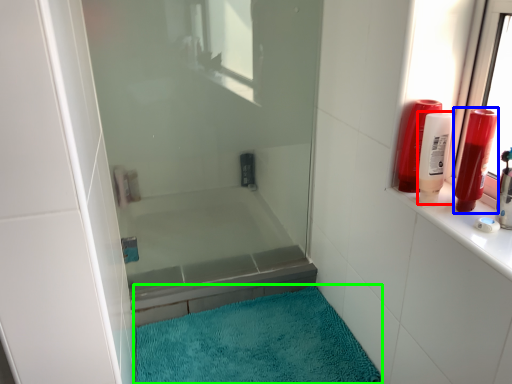
Question: Which is nearer to the toiletry (highlighted by a red box)? toiletry (highlighted by a blue box) or bath mat (highlighted by a green box).

Choices:
 (A) toiletry
 (B) bath mat

Answer: (A)